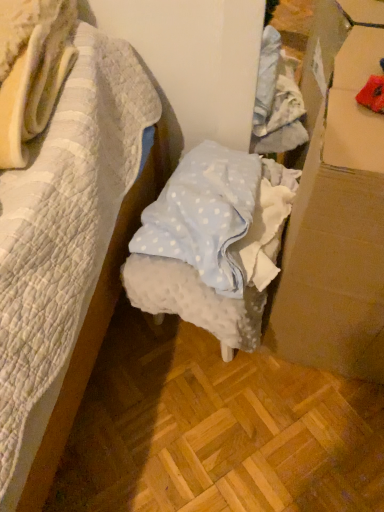
Question: Is white dotted fabric at center wider than cardboard at right?

Choices:
 (A) no
 (B) yes

Answer: (B)

Question: Is white dotted fabric at center closer to camera compared to cardboard at right?

Choices:
 (A) yes
 (B) no

Answer: (B)

Question: Can you confirm if white dotted fabric at center is smaller than cardboard at right?

Choices:
 (A) yes
 (B) no

Answer: (A)

Question: Can you confirm if white dotted fabric at center is taller than cardboard at right?

Choices:
 (A) yes
 (B) no

Answer: (B)

Question: Does white dotted fabric at center have a lesser width compared to cardboard at right?

Choices:
 (A) yes
 (B) no

Answer: (B)

Question: Is white dotted fabric at center positioned far away from cardboard at right?

Choices:
 (A) yes
 (B) no

Answer: (B)

Question: Are cardboard at right and white dotted fabric at center located far from each other?

Choices:
 (A) yes
 (B) no

Answer: (B)

Question: Is cardboard at right thinner than white dotted fabric at center?

Choices:
 (A) yes
 (B) no

Answer: (A)

Question: Is cardboard at right closer to the viewer compared to white dotted fabric at center?

Choices:
 (A) no
 (B) yes

Answer: (B)

Question: Is cardboard at right with white dotted fabric at center?

Choices:
 (A) no
 (B) yes

Answer: (A)

Question: From the image's perspective, does cardboard at right appear lower than white dotted fabric at center?

Choices:
 (A) yes
 (B) no

Answer: (A)

Question: Considering the relative sizes of cardboard at right and white dotted fabric at center in the image provided, is cardboard at right taller than white dotted fabric at center?

Choices:
 (A) no
 (B) yes

Answer: (B)

Question: Considering their positions, is cardboard at right located in front of or behind white dotted fabric at center?

Choices:
 (A) behind
 (B) front

Answer: (B)